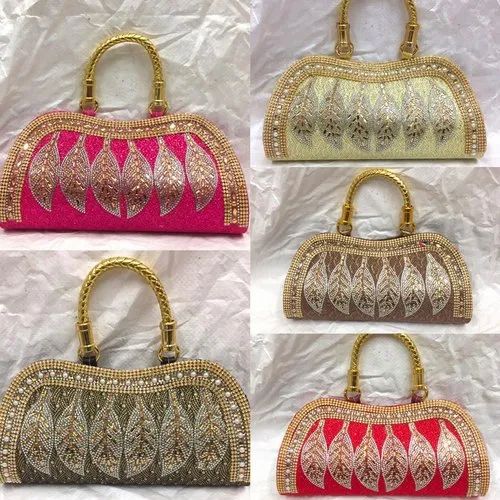
The image size is (500, 500). In order to click on golden handles in this screenshot , I will do `click(102, 265)`, `click(128, 40)`, `click(344, 15)`, `click(385, 177)`, `click(360, 338)`.